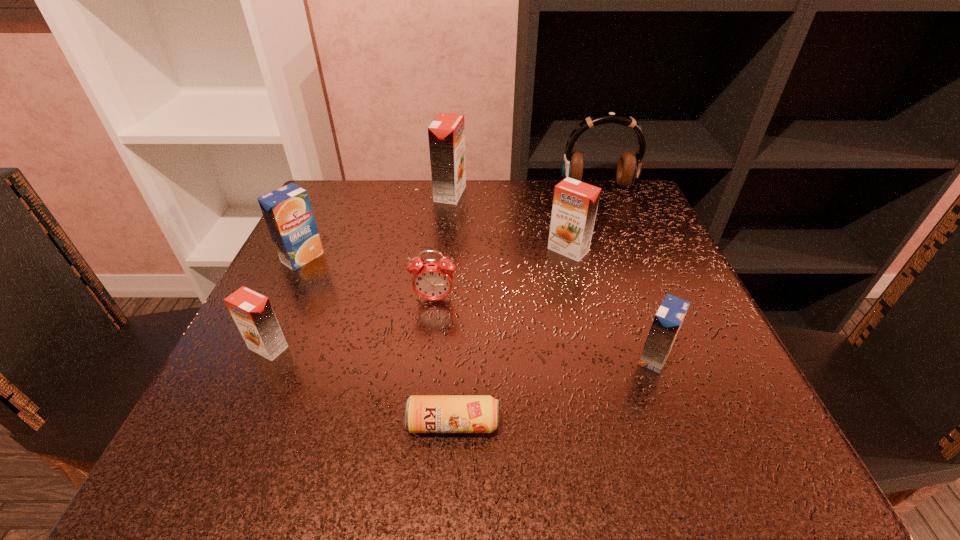
Identify the location of vacant space that satisfies the following two spatial constraints: 1. on the back side of the bigger blue orange_juice; 2. on the left side of the second smallest orange orange juice. The image size is (960, 540). (306, 250).